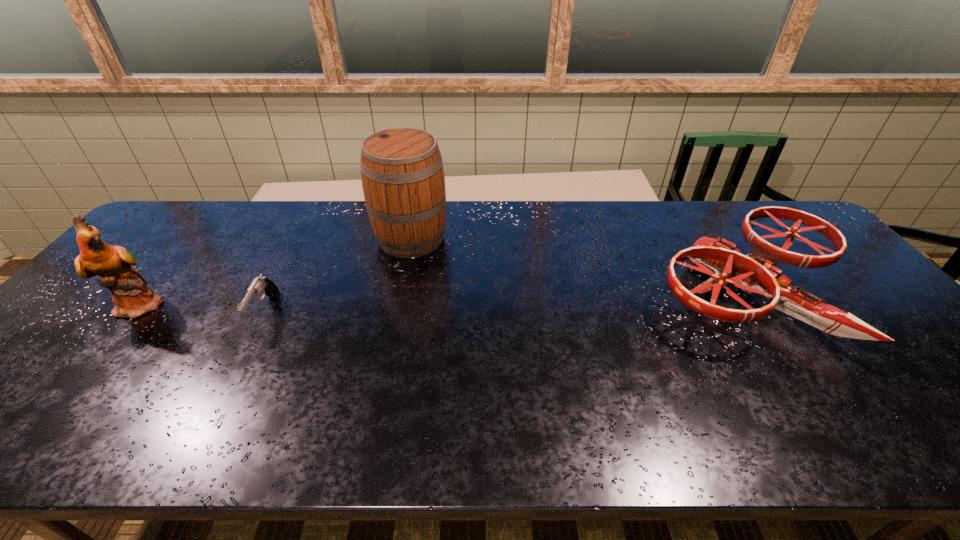
This screenshot has width=960, height=540. I want to click on vacant region between the third object from left to right and the leftmost object, so click(276, 272).

The width and height of the screenshot is (960, 540). I want to click on vacant region between the parrot and the second object from right to left, so tap(276, 272).

At what (x,y) coordinates should I click in order to perform the action: click on free spot between the parrot and the shortest object. Please return your answer as a coordinate pair (x, y). Looking at the image, I should click on (204, 308).

The width and height of the screenshot is (960, 540). I want to click on vacant space that's between the second shortest object and the second object from right to left, so click(578, 266).

You are a GUI agent. You are given a task and a screenshot of the screen. Output one action in this format:
    pyautogui.click(x=<x>, y=<y>)
    Task: Click on the free point between the leftmost object and the second object from left to right
    The width and height of the screenshot is (960, 540).
    Given the screenshot: What is the action you would take?
    pyautogui.click(x=204, y=308)

Where is `free point between the third object from right to left and the drone`? free point between the third object from right to left and the drone is located at coordinates (505, 303).

Image resolution: width=960 pixels, height=540 pixels. I want to click on empty space that is in between the parrot and the gun, so click(x=204, y=308).

I want to click on free space that is in between the drone and the leftmost object, so click(444, 299).

This screenshot has height=540, width=960. I want to click on vacant region between the rightmost object and the third object from right to left, so click(505, 303).

Locate which object is the closest to the parrot. Please provide its 2D coordinates. Your answer should be formatted as a tuple, i.e. [(x, y)], where the tuple contains the x and y coordinates of a point satisfying the conditions above.

[(260, 285)]